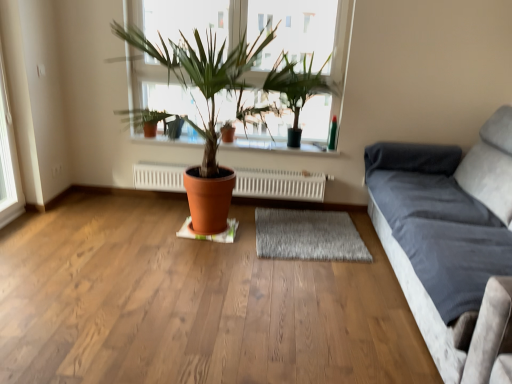
Identify the location of gray shaggy rug at center. (308, 235).

What do you see at coordinates (280, 184) in the screenshot?
I see `white radiator at center` at bounding box center [280, 184].

Image resolution: width=512 pixels, height=384 pixels. Describe the element at coordinates (8, 159) in the screenshot. I see `white plastic window frame at left` at that location.

What are the coordinates of `white plastic window frame at left` in the screenshot? It's located at (8, 159).

Measure the distance between terracotta clay pot at center and camera.

terracotta clay pot at center and camera are 9.56 feet apart.

Measure the distance between point (228, 128) and camera.

A distance of 9.66 feet exists between point (228, 128) and camera.

In order to click on velvet gray couch at right in this screenshot , I will do `click(451, 242)`.

Find the location of a particular element. gray shaggy rug at center is located at coordinates (308, 235).

Considering the sizes of objects velvet gray couch at right and white radiator at center in the image provided, who is bigger, velvet gray couch at right or white radiator at center?

velvet gray couch at right.

This screenshot has width=512, height=384. What are the coordinates of `studio couch lying below the white radiator at center (from the image's perspective)` in the screenshot? It's located at (451, 242).

How different are the orientations of velvet gray couch at right and white radiator at center in degrees?

They differ by 89.3 degrees in their facing directions.

Consider the image. Considering the positions of objects velvet gray couch at right and white radiator at center in the image provided, who is more to the right, velvet gray couch at right or white radiator at center?

From the viewer's perspective, velvet gray couch at right appears more on the right side.

Does matte glass window at center appear on the right side of white plastic window frame at left?

Indeed, matte glass window at center is positioned on the right side of white plastic window frame at left.

Is matte glass window at center oriented away from white plastic window frame at left?

No.

Which of these two, matte glass window at center or white plastic window frame at left, is smaller?

white plastic window frame at left.

Does matte glass window at center have a greater width compared to white plastic window frame at left?

Correct, the width of matte glass window at center exceeds that of white plastic window frame at left.

Is gray shaggy rug at center not close to white plastic window frame at left?

Yes.

At what (x,y) coordinates should I click in order to perform the action: click on mat behind the white plastic window frame at left. Please return your answer as a coordinate pair (x, y). The width and height of the screenshot is (512, 384). Looking at the image, I should click on click(x=308, y=235).

Can you confirm if gray shaggy rug at center is thinner than white plastic window frame at left?

No.

Which is in front, gray shaggy rug at center or white plastic window frame at left?

Positioned in front is white plastic window frame at left.

What's the angular difference between white radiator at center and velvet gray couch at right's facing directions?

89.3 degrees separate the facing orientations of white radiator at center and velvet gray couch at right.

Which of these two, white radiator at center or velvet gray couch at right, is wider?

Wider between the two is velvet gray couch at right.

Is white radiator at center at the left side of velvet gray couch at right?

Yes, white radiator at center is to the left of velvet gray couch at right.

The width and height of the screenshot is (512, 384). I want to click on studio couch beneath the terracotta clay pot at center (from a real-world perspective), so click(x=451, y=242).

Between velvet gray couch at right and terracotta clay pot at center, which one has more height?

Standing taller between the two is velvet gray couch at right.

Based on their positions, is velvet gray couch at right located to the left or right of terracotta clay pot at center?

velvet gray couch at right is positioned on terracotta clay pot at center's right side.

Is velvet gray couch at right not inside terracotta clay pot at center?

That's correct, velvet gray couch at right is outside of terracotta clay pot at center.

Between point (325, 232) and point (230, 124), which one is positioned in front?

The point (230, 124) is in front.

From the picture: How much distance is there between gray shaggy rug at center and terracotta clay pot at center?

gray shaggy rug at center and terracotta clay pot at center are 37.24 inches apart from each other.

Is gray shaggy rug at center touching terracotta clay pot at center?

No.

I want to click on mat below the terracotta clay pot at center (from the image's perspective), so click(x=308, y=235).

Is the depth of green matte plant at upper center less than that of white radiator at center?

Yes, green matte plant at upper center is in front of white radiator at center.

Does green matte plant at upper center have a lesser height compared to white radiator at center?

No, green matte plant at upper center is not shorter than white radiator at center.

Who is bigger, green matte plant at upper center or white radiator at center?

With larger size is green matte plant at upper center.

Where is `heater above the velvet gray couch at right (from the image's perspective)`? The width and height of the screenshot is (512, 384). heater above the velvet gray couch at right (from the image's perspective) is located at coordinates 280,184.

Image resolution: width=512 pixels, height=384 pixels. I want to click on window frame beneath the matte glass window at center (from a real-world perspective), so click(x=8, y=159).

Looking at the image, which one is located further to matte glass window at center, velvet gray couch at right or terracotta clay pot at center?

velvet gray couch at right.

When comparing their distances from terracotta clay pot at center, does white radiator at center or velvet gray couch at right seem further?

velvet gray couch at right is further to terracotta clay pot at center.

Based on the photo, which object lies further to the anchor point green matte plant at upper center, white plastic window frame at left or terracotta clay pot at center?

white plastic window frame at left is positioned further to the anchor green matte plant at upper center.

When comparing their distances from terracotta clay pot at center, does white radiator at center or white plastic window frame at left seem further?

white plastic window frame at left is positioned further to the anchor terracotta clay pot at center.

Which object lies further to the anchor point white plastic window frame at left, gray shaggy rug at center or matte glass window at center?

gray shaggy rug at center lies further to white plastic window frame at left than the other object.

Which object lies nearer to the anchor point green matte plant at upper center, gray shaggy rug at center or velvet gray couch at right?

gray shaggy rug at center is closer to green matte plant at upper center.

When comparing their distances from white plastic window frame at left, does matte glass window at center or terracotta clay pot at center seem closer?

matte glass window at center is closer to white plastic window frame at left.

Which object lies nearer to the anchor point terracotta pot at center, white radiator at center or matte glass window at center?

white radiator at center lies closer to terracotta pot at center than the other object.

The image size is (512, 384). Identify the location of houseplant between white plastic window frame at left and gray shaggy rug at center. (296, 89).

You are a GUI agent. You are given a task and a screenshot of the screen. Output one action in this format:
    pyautogui.click(x=<x>, y=<y>)
    Task: Click on the window between terracotta pot at center and green matte plant at upper center from left to right
    
    Given the screenshot: What is the action you would take?
    pyautogui.click(x=258, y=30)

At what (x,y) coordinates should I click in order to perform the action: click on heater located between white plastic window frame at left and gray shaggy rug at center in the left-right direction. Please return your answer as a coordinate pair (x, y). Looking at the image, I should click on (280, 184).

The width and height of the screenshot is (512, 384). I want to click on window between velvet gray couch at right and terracotta clay pot at center from front to back, so click(x=258, y=30).